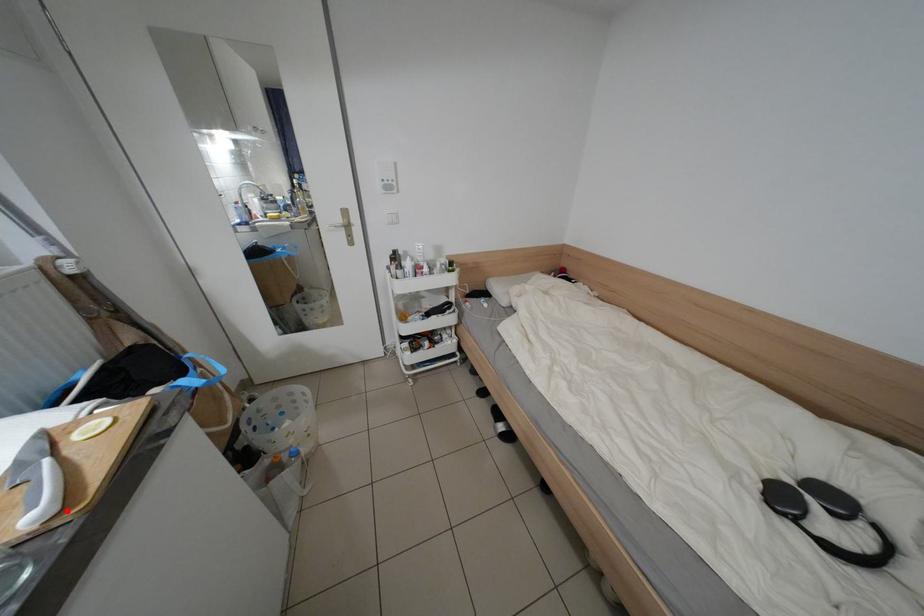
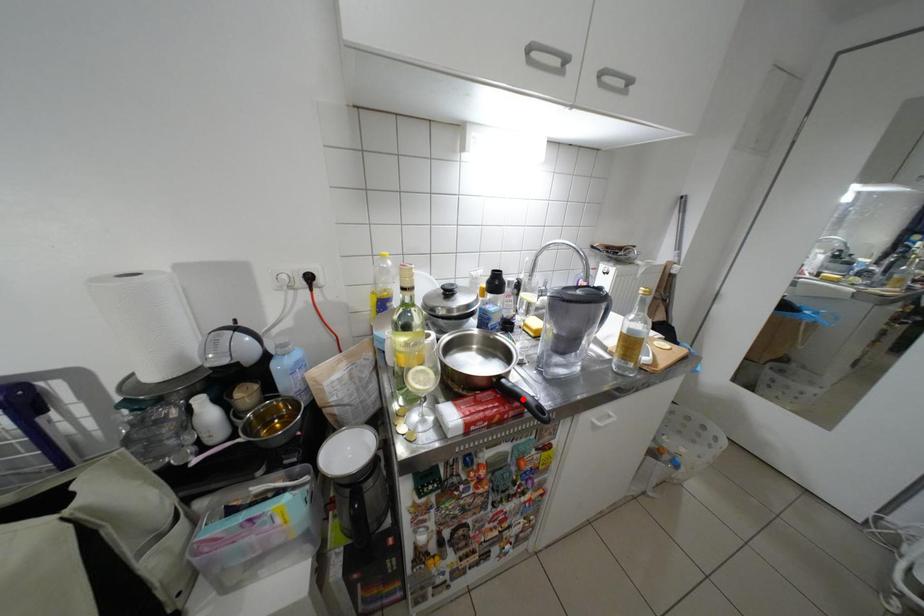
I am providing you with two images of the same scene from different viewpoints. A red point is marked on the first image and another point is marked on the second image. Does the point marked in image1 correspond to the same location as the one in image2?

No